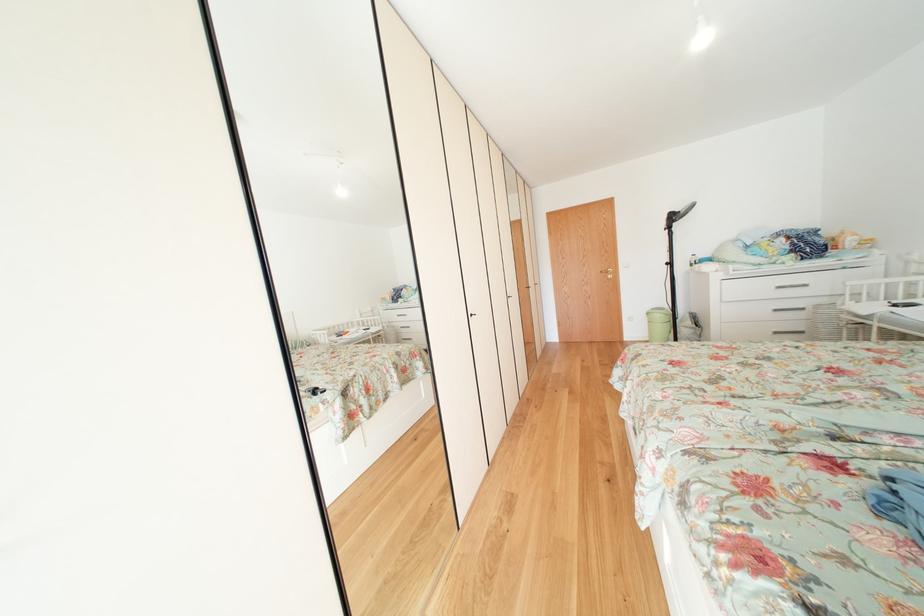
Where is `black cabinet lock`? black cabinet lock is located at coordinates (471, 315).